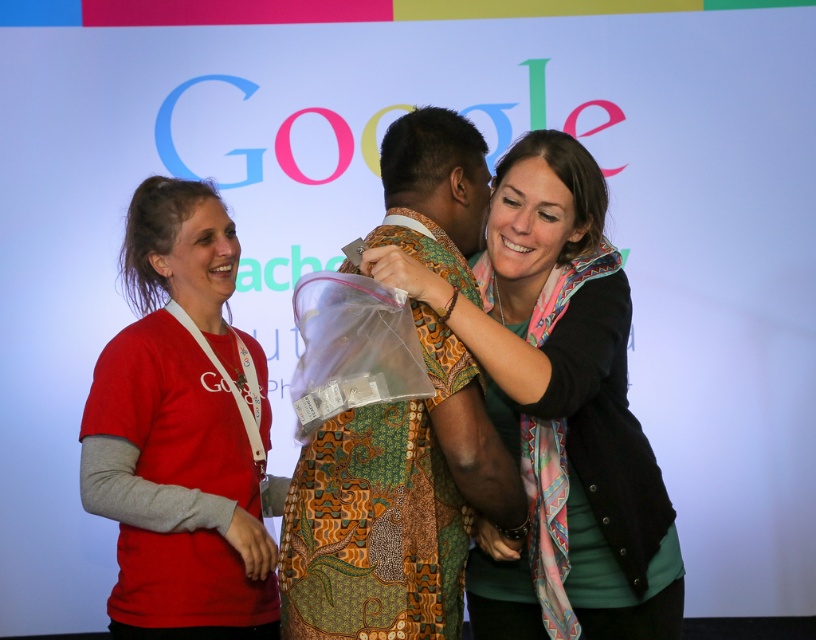
Question: Can you confirm if multicolored scarf at center is positioned to the right of red cotton t-shirt at left?

Choices:
 (A) no
 (B) yes

Answer: (B)

Question: Can you confirm if multicolored scarf at center is positioned below batik-patterned shirt at center?

Choices:
 (A) no
 (B) yes

Answer: (B)

Question: Which object is the farthest from the multicolored scarf at center?

Choices:
 (A) batik-patterned shirt at center
 (B) red cotton t-shirt at left

Answer: (B)

Question: Does multicolored scarf at center have a greater width compared to batik-patterned shirt at center?

Choices:
 (A) yes
 (B) no

Answer: (A)

Question: Which of the following is the closest to the observer?

Choices:
 (A) red cotton t-shirt at left
 (B) multicolored scarf at center

Answer: (B)

Question: Which is nearer to the red cotton t-shirt at left?

Choices:
 (A) multicolored scarf at center
 (B) batik-patterned shirt at center

Answer: (B)